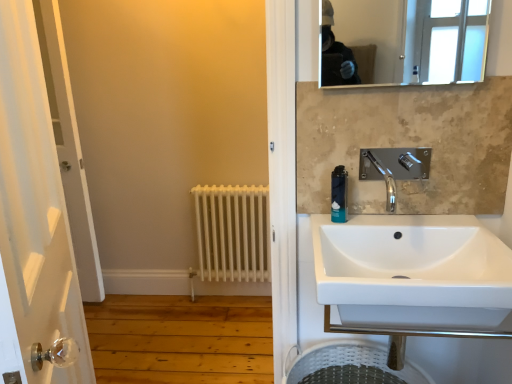
Identify the location of vacant area located to the right-hand side of black plastic soap dispenser at upper right. (380, 223).